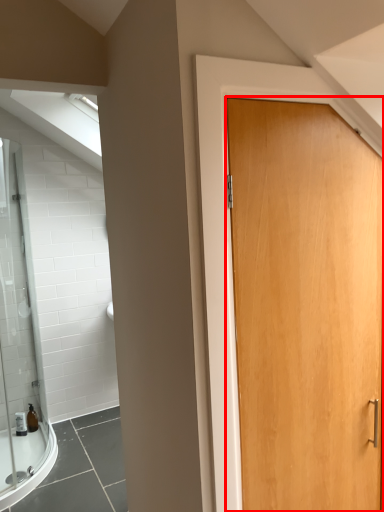
Question: Observing the image, what is the correct spatial positioning of door (annotated by the red box) in reference to toiletry?

Choices:
 (A) right
 (B) left

Answer: (A)